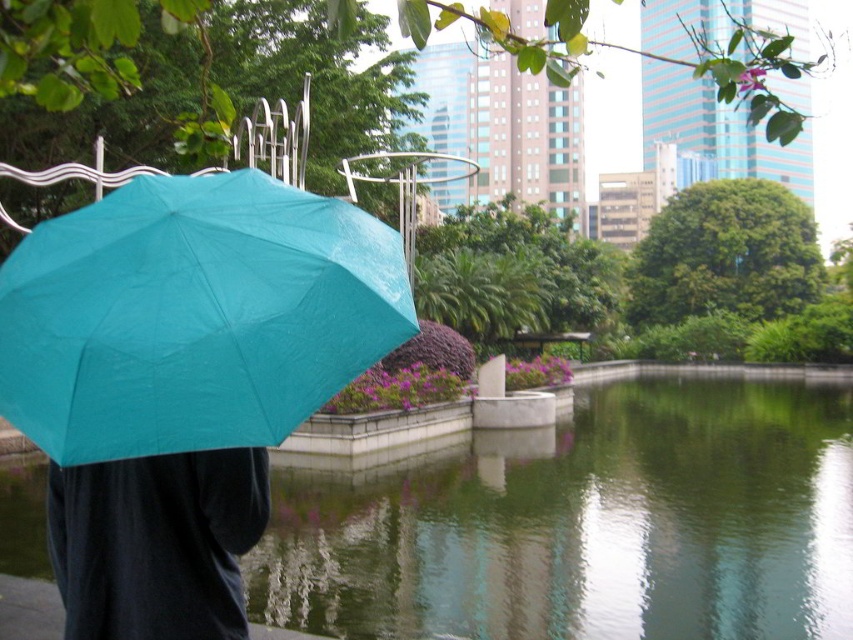
You are a photographer trying to capture the entire scene of the teal matte umbrella at left and the matte black pants at lower left in one shot. Based on the distance between them, what is the minimum focal length lens you should use if your camera sensor has a diagonal measurement of 1.4 inches?

The minimum focal length lens required would be approximately 15.46 inches divided by the sensor diagonal of 1.4 inches, resulting in a focal length of about 11 inches to ensure both the teal matte umbrella at left and the matte black pants at lower left fit in the frame.

You are standing in the park and see the teal matte umbrella at left and the matte black pants at lower left. Which object is positioned to the right of the other?

The teal matte umbrella at left is positioned to the right of the matte black pants at lower left.